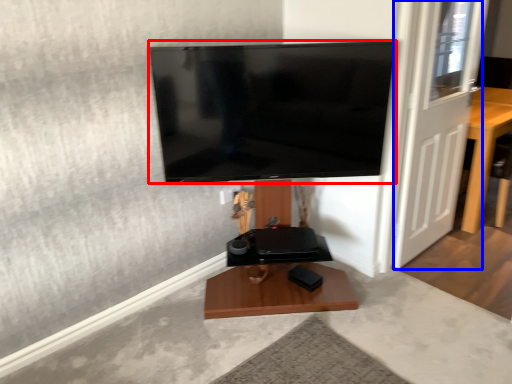
Question: Which point is closer to the camera, television (highlighted by a red box) or door (highlighted by a blue box)?

Choices:
 (A) television
 (B) door

Answer: (A)